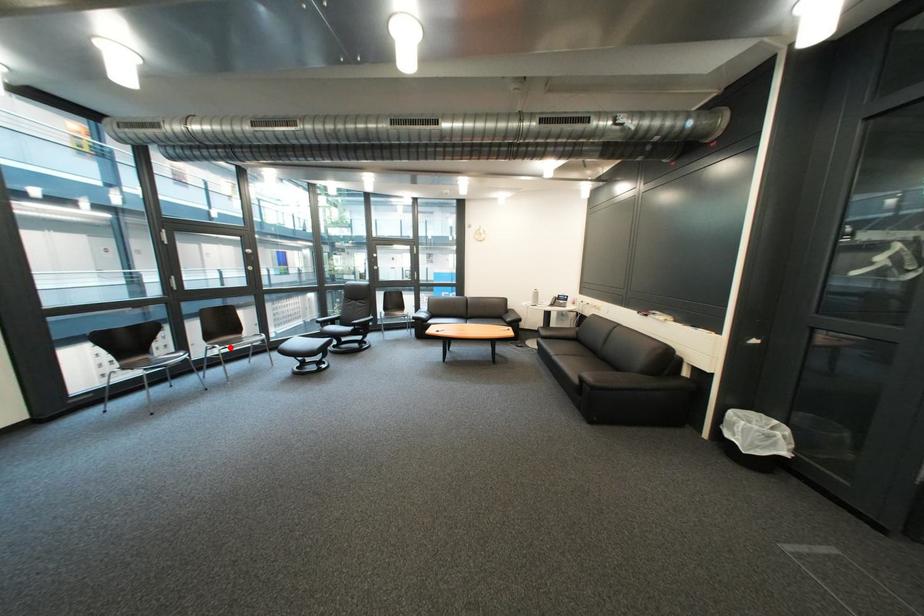
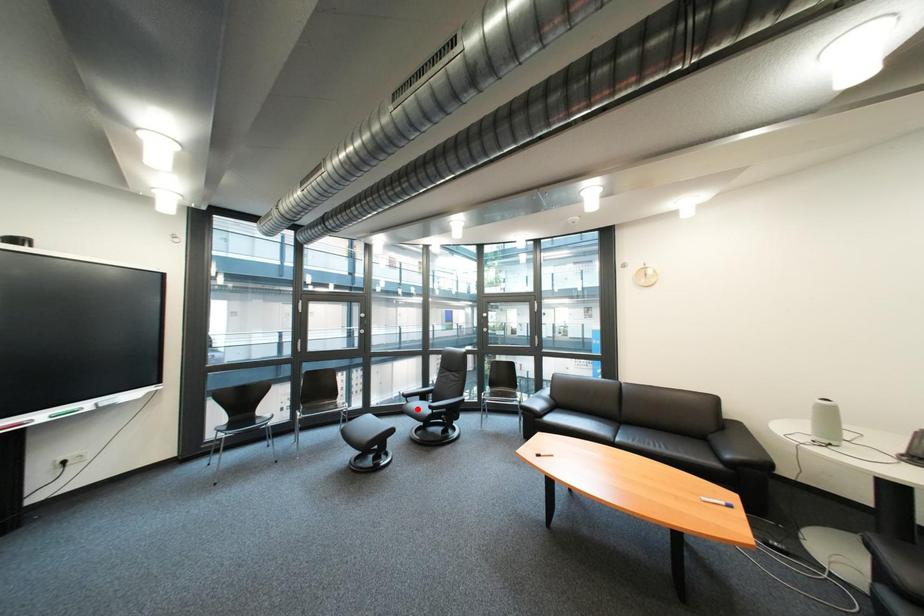
I am providing you with two images of the same scene from different viewpoints. A red point is marked on the first image and another point is marked on the second image. Does the point marked in image1 correspond to the same location as the one in image2?

No